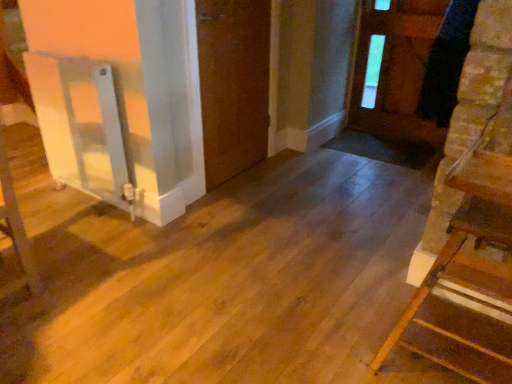
Question: Can you confirm if brown matte door at center, acting as the 2th door starting from the right, is positioned to the left of brown wooden door at upper right, which appears as the first door when viewed from the right?

Choices:
 (A) no
 (B) yes

Answer: (B)

Question: Is brown matte door at center, which is the 1th door from left to right, beside brown wooden door at upper right, marked as the 2th door in a left-to-right arrangement?

Choices:
 (A) yes
 (B) no

Answer: (B)

Question: Can you confirm if brown matte door at center, which is the 1th door from left to right, is shorter than brown wooden door at upper right, which appears as the first door when viewed from the right?

Choices:
 (A) no
 (B) yes

Answer: (A)

Question: Is brown matte door at center, which is the 1th door from left to right, completely or partially outside of brown wooden door at upper right, which appears as the first door when viewed from the right?

Choices:
 (A) no
 (B) yes

Answer: (B)

Question: Does brown matte door at center, acting as the 2th door starting from the right, contain brown wooden door at upper right, marked as the 2th door in a left-to-right arrangement?

Choices:
 (A) no
 (B) yes

Answer: (A)

Question: Is brown matte door at center, which is the 1th door from left to right, turned away from brown wooden door at upper right, marked as the 2th door in a left-to-right arrangement?

Choices:
 (A) no
 (B) yes

Answer: (A)

Question: Can you confirm if wooden staircase at right is bigger than brown wooden door at upper right, which appears as the first door when viewed from the right?

Choices:
 (A) no
 (B) yes

Answer: (B)

Question: Considering the relative sizes of wooden staircase at right and brown wooden door at upper right, marked as the 2th door in a left-to-right arrangement, in the image provided, is wooden staircase at right taller than brown wooden door at upper right, marked as the 2th door in a left-to-right arrangement,?

Choices:
 (A) no
 (B) yes

Answer: (A)

Question: Is wooden staircase at right further to camera compared to brown wooden door at upper right, marked as the 2th door in a left-to-right arrangement?

Choices:
 (A) yes
 (B) no

Answer: (B)

Question: Can you confirm if wooden staircase at right is positioned to the left of brown wooden door at upper right, which appears as the first door when viewed from the right?

Choices:
 (A) no
 (B) yes

Answer: (B)

Question: Can you confirm if wooden staircase at right is smaller than brown wooden door at upper right, marked as the 2th door in a left-to-right arrangement?

Choices:
 (A) yes
 (B) no

Answer: (B)

Question: Is wooden staircase at right facing away from brown wooden door at upper right, which appears as the first door when viewed from the right?

Choices:
 (A) no
 (B) yes

Answer: (A)

Question: Can you see brown matte door at center, which is the 1th door from left to right, touching wooden staircase at right?

Choices:
 (A) no
 (B) yes

Answer: (A)